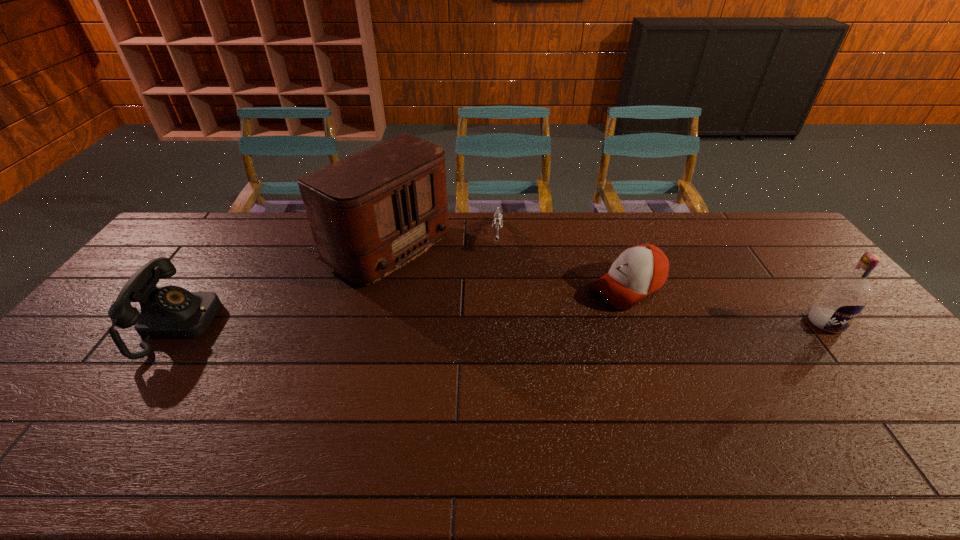
You are a GUI agent. You are given a task and a screenshot of the screen. Output one action in this format:
    pyautogui.click(x=<x>, y=<y>)
    Task: Click on the leftmost object
    
    Given the screenshot: What is the action you would take?
    pyautogui.click(x=166, y=312)

This screenshot has width=960, height=540. Identify the location of telephone. (166, 312).

Identify the location of the second tallest object. (845, 295).

The image size is (960, 540). I want to click on the rightmost object, so click(x=845, y=295).

You are a GUI agent. You are given a task and a screenshot of the screen. Output one action in this format:
    pyautogui.click(x=<x>, y=<y>)
    Task: Click on the radio receiver
    
    Given the screenshot: What is the action you would take?
    pyautogui.click(x=371, y=213)

Identify the location of the second object from left to right. (371, 213).

The image size is (960, 540). I want to click on the second object from right to left, so click(x=641, y=270).

Locate an element on the screen. baseball cap is located at coordinates (641, 270).

Locate an element on the screen. gun is located at coordinates (497, 221).

Locate an element on the screen. This screenshot has width=960, height=540. the shortest object is located at coordinates (497, 221).